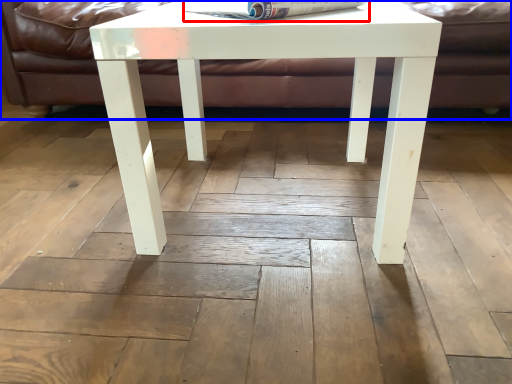
Question: Among these objects, which one is nearest to the camera, magazine (highlighted by a red box) or couch (highlighted by a blue box)?

Choices:
 (A) magazine
 (B) couch

Answer: (A)